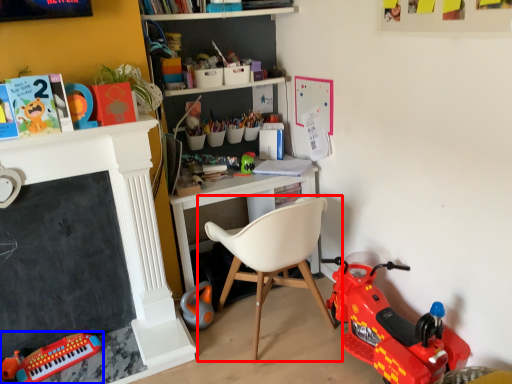
Question: Which point is closer to the camera, chair (highlighted by a red box) or toy (highlighted by a blue box)?

Choices:
 (A) chair
 (B) toy

Answer: (A)